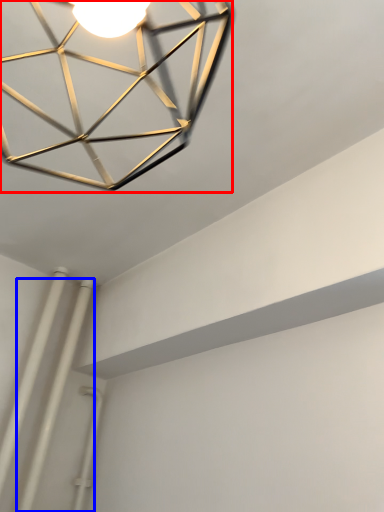
Question: Which object appears farthest to the camera in this image, lamp (highlighted by a red box) or pipe (highlighted by a blue box)?

Choices:
 (A) lamp
 (B) pipe

Answer: (B)